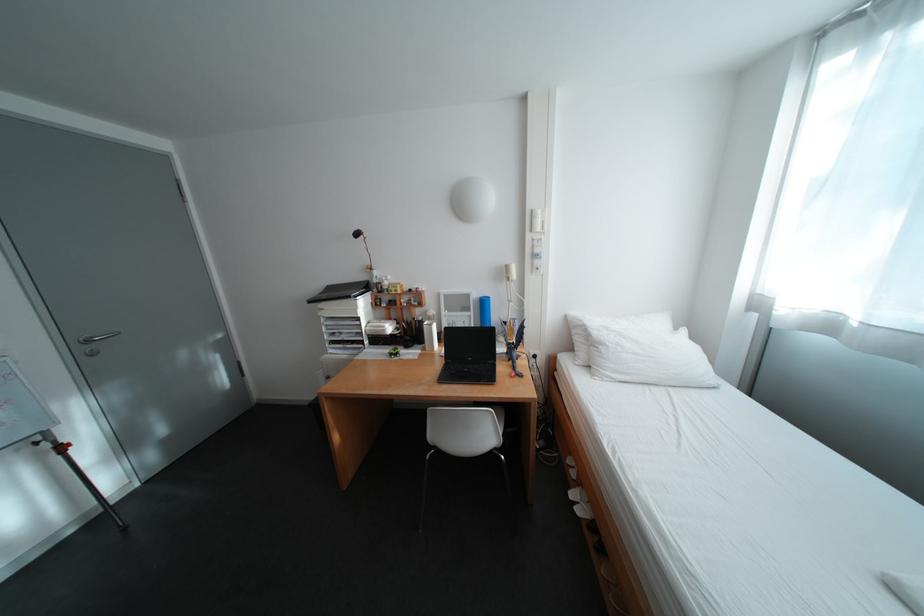
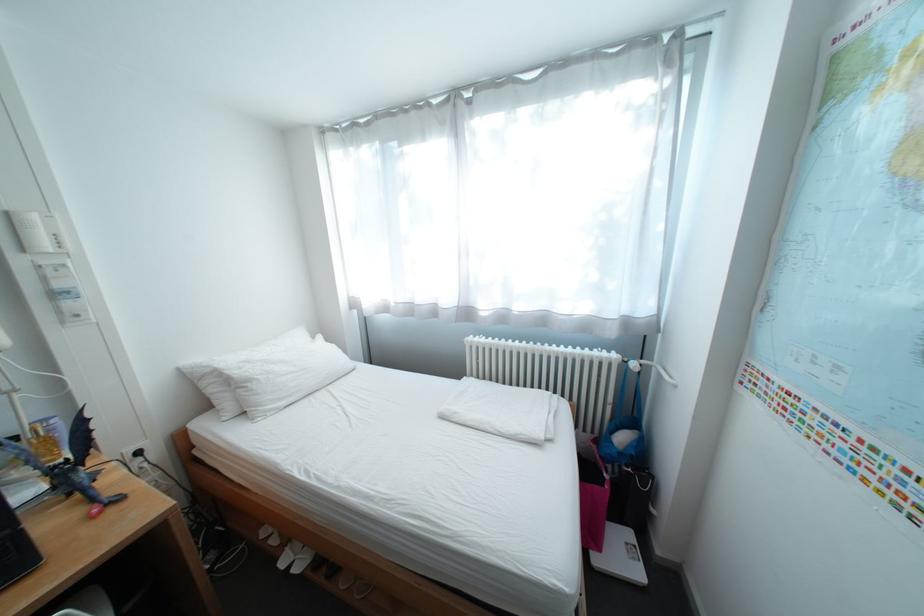
Find the pixel in the second image that matches (x=591, y=504) in the first image.

(307, 562)